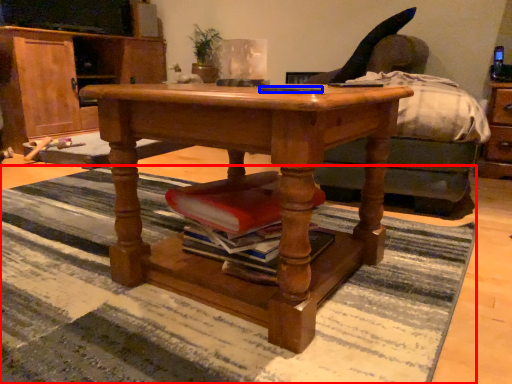
Question: Which object is further to the camera taking this photo, mat (highlighted by a red box) or remote control (highlighted by a blue box)?

Choices:
 (A) mat
 (B) remote control

Answer: (B)